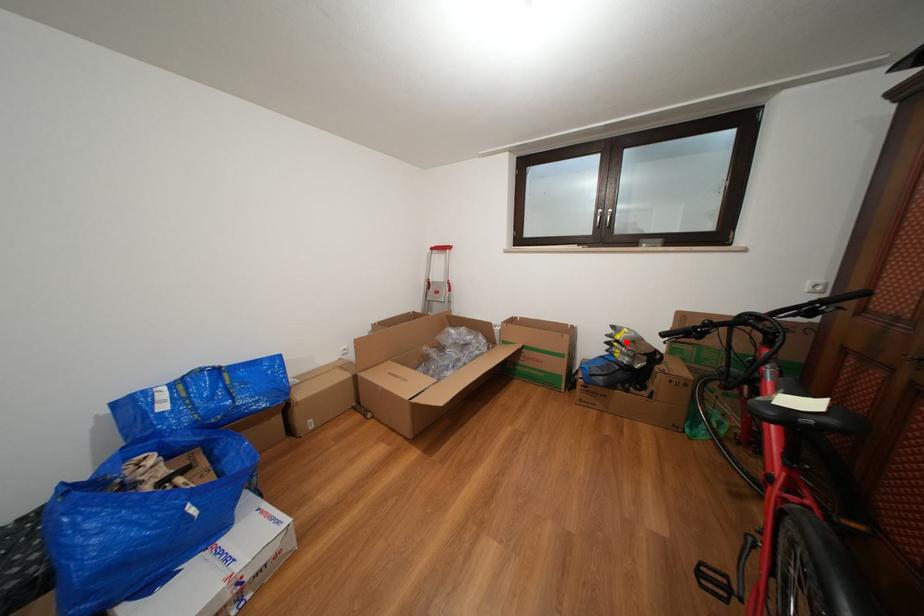
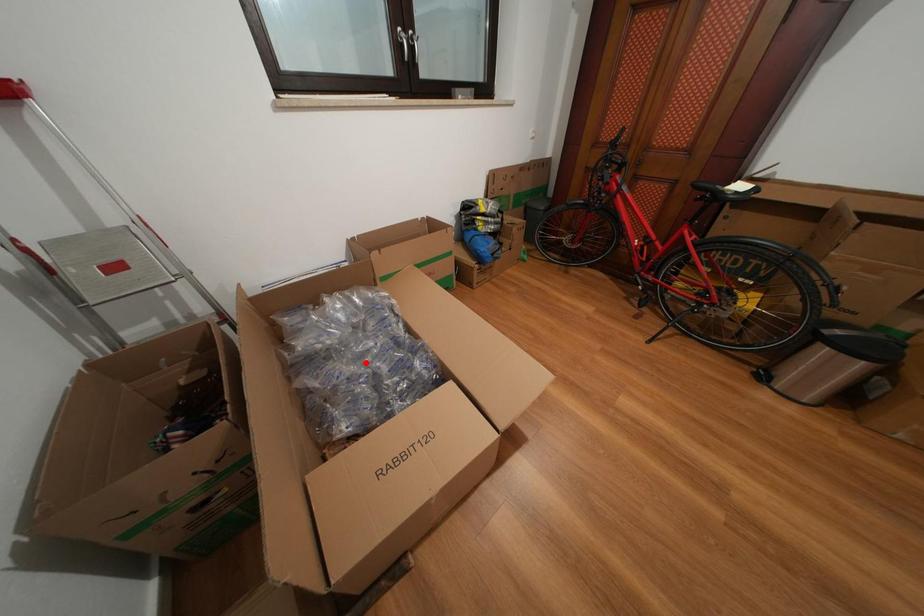
I am providing you with two images of the same scene from different viewpoints. A red point is marked on the first image and another point is marked on the second image. Is the red point in image1 aligned with the point shown in image2?

No